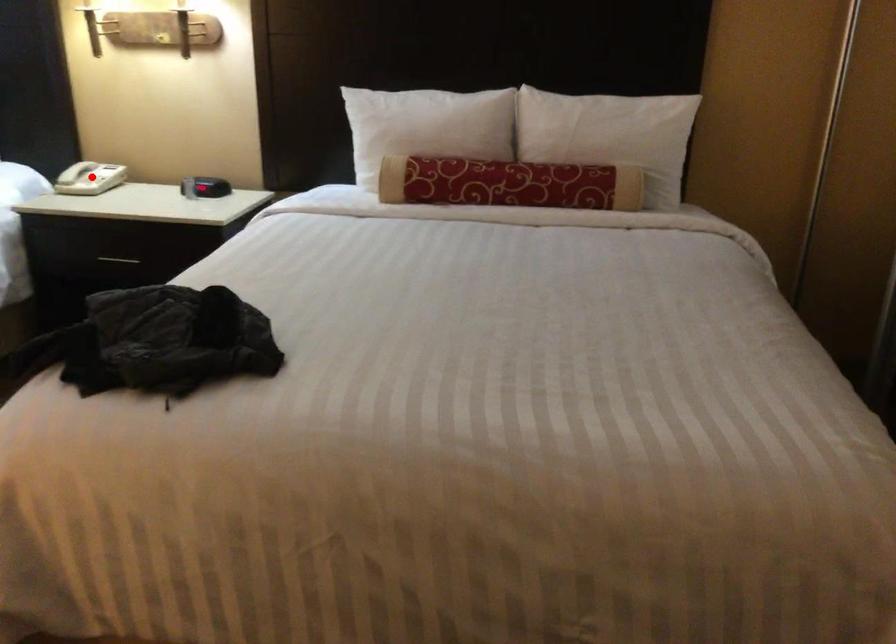
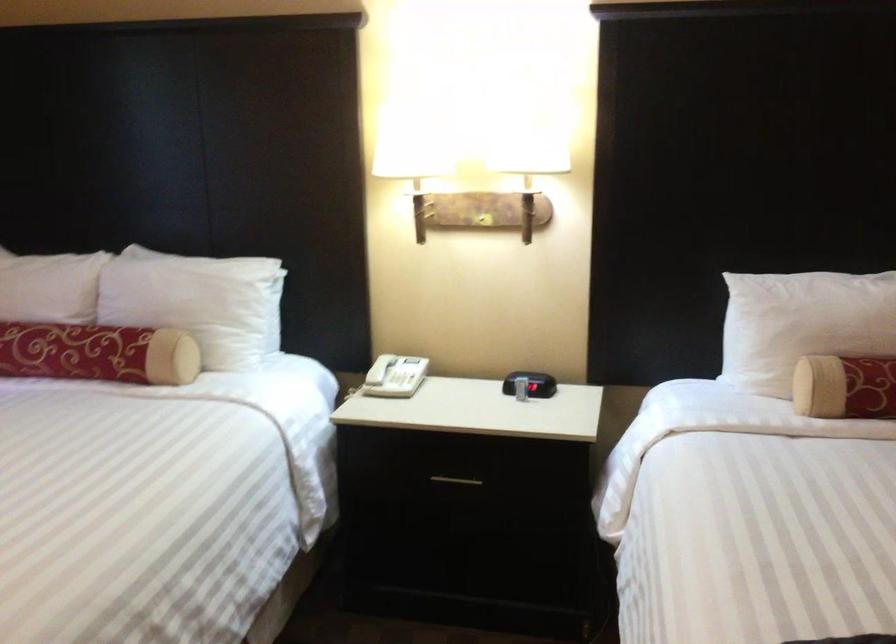
Question: A red point is marked in image1. In image2, is the corresponding 3D point closer to the camera or farther? Reply with the corresponding letter.

Choices:
 (A) The corresponding 3D point is closer.
 (B) The corresponding 3D point is farther.

Answer: (A)